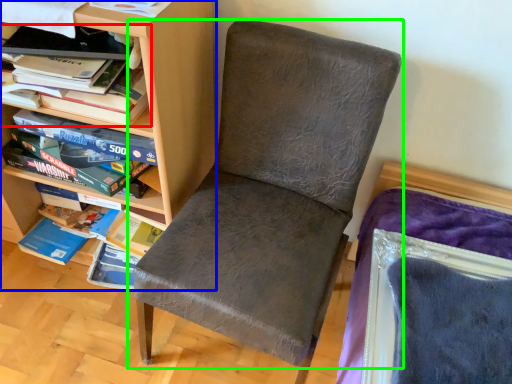
Question: Considering the real-world distances, which object is farthest from book (highlighted by a red box)? shelf (highlighted by a blue box) or chair (highlighted by a green box)?

Choices:
 (A) shelf
 (B) chair

Answer: (B)